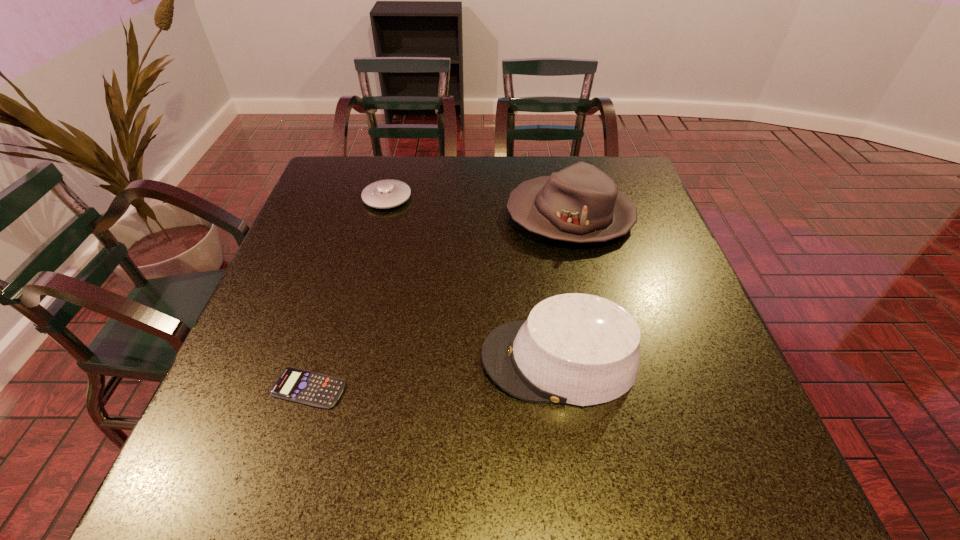
Where is `the taller hat`? This screenshot has width=960, height=540. the taller hat is located at coordinates pos(580,203).

This screenshot has width=960, height=540. Find the location of `the farther hat`. the farther hat is located at coordinates (580, 203).

Find the location of a particular element. The image size is (960, 540). the shorter hat is located at coordinates (578, 349).

The width and height of the screenshot is (960, 540). In order to click on the nearer hat in this screenshot , I will do `click(578, 349)`.

Find the location of a particular element. the third tallest object is located at coordinates (389, 193).

At what (x,y) coordinates should I click in order to perform the action: click on calculator. Please return your answer as a coordinate pair (x, y). Looking at the image, I should click on (297, 385).

The width and height of the screenshot is (960, 540). What are the coordinates of `free space located 0.320m on the decorative side of the tallest object` in the screenshot? It's located at (389, 216).

Identify the location of vacant space located 0.170m on the decorative side of the tallest object. The image size is (960, 540). (444, 216).

This screenshot has height=540, width=960. I want to click on free spot located 0.280m on the decorative side of the tallest object, so pos(403,216).

The width and height of the screenshot is (960, 540). Identify the location of free space located on the front-facing side of the nearer hat. tap(360, 360).